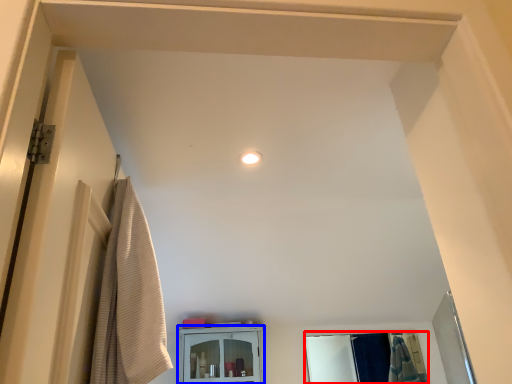
Question: Among these objects, which one is farthest to the camera, mirror (highlighted by a red box) or cabinetry (highlighted by a blue box)?

Choices:
 (A) mirror
 (B) cabinetry

Answer: (A)